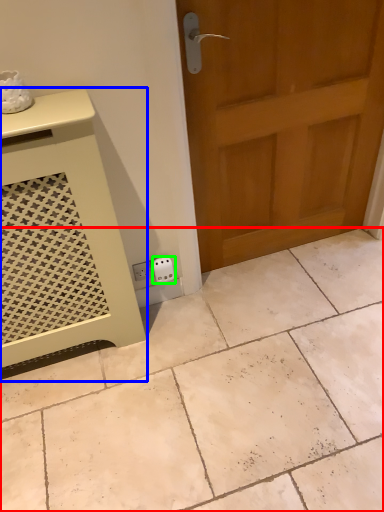
Question: Which is nearer to the ceramic tile (highlighted by a red box)? vanity (highlighted by a blue box) or electric outlet (highlighted by a green box).

Choices:
 (A) vanity
 (B) electric outlet

Answer: (A)